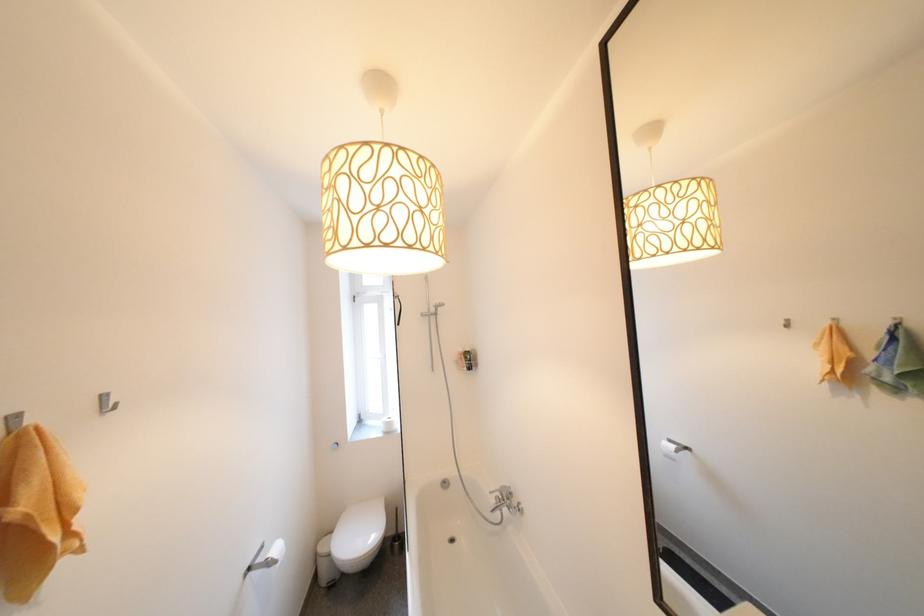
Image resolution: width=924 pixels, height=616 pixels. I want to click on white toilet lid, so click(x=359, y=528).